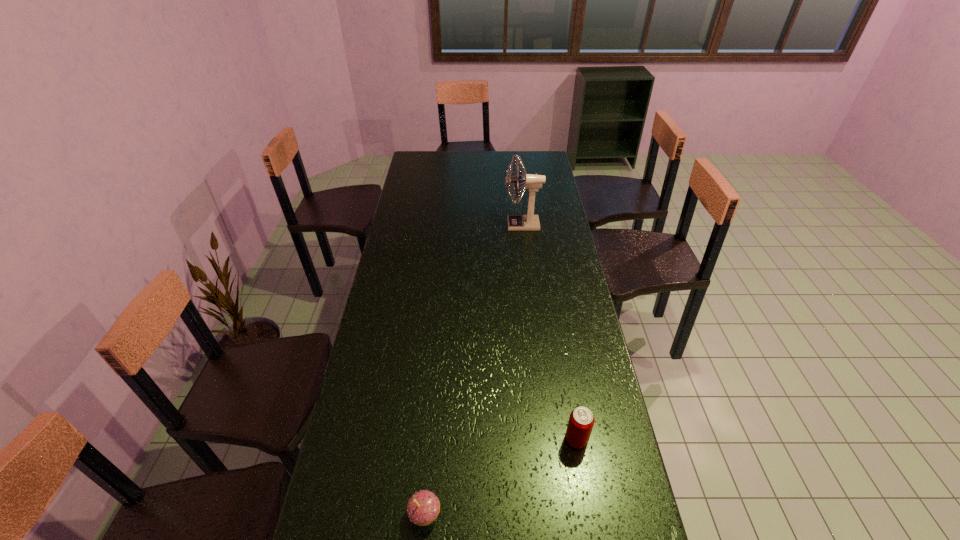
Where is `free space that satisfies the following two spatial constraints: 1. on the front-facing side of the can; 2. on the left side of the tallest object`? This screenshot has height=540, width=960. free space that satisfies the following two spatial constraints: 1. on the front-facing side of the can; 2. on the left side of the tallest object is located at coordinates 548,440.